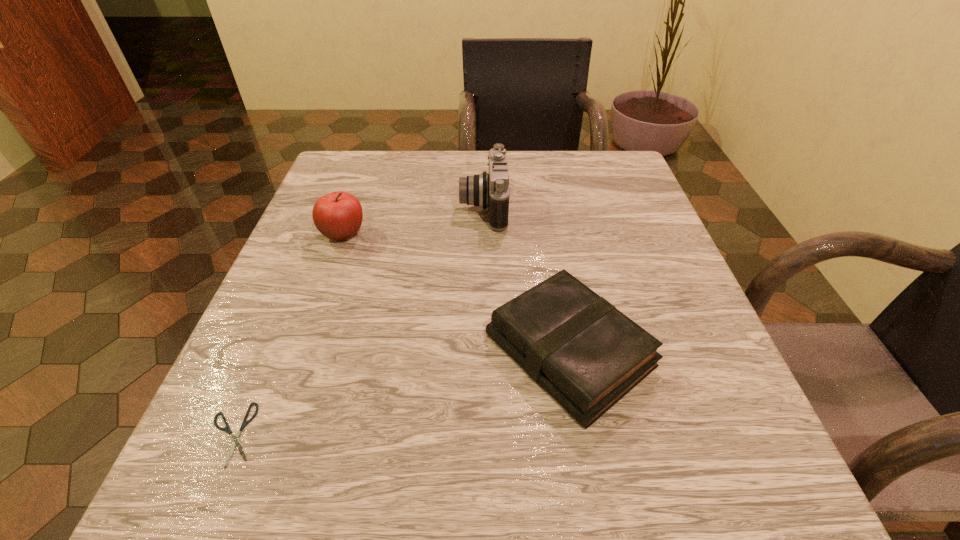
The width and height of the screenshot is (960, 540). Identify the location of object that is at the far edge. (485, 190).

The width and height of the screenshot is (960, 540). Identify the location of object at the near edge. (227, 429).

Locate an element on the screen. Image resolution: width=960 pixels, height=540 pixels. apple present at the left edge is located at coordinates (338, 215).

Where is `shears at the left edge`? This screenshot has height=540, width=960. shears at the left edge is located at coordinates (227, 429).

Where is `object positioned at the right edge`? Image resolution: width=960 pixels, height=540 pixels. object positioned at the right edge is located at coordinates (585, 353).

Identify the location of object present at the near left corner. (227, 429).

Identify the location of free point at the far edge. This screenshot has width=960, height=540. (550, 179).

Find the location of `vacant region at the near edge of the desktop`. vacant region at the near edge of the desktop is located at coordinates (560, 504).

Locate an element on the screen. This screenshot has width=960, height=540. free region at the left edge of the desktop is located at coordinates (283, 264).

Image resolution: width=960 pixels, height=540 pixels. Find the location of `vacant region at the right edge`. vacant region at the right edge is located at coordinates (642, 263).